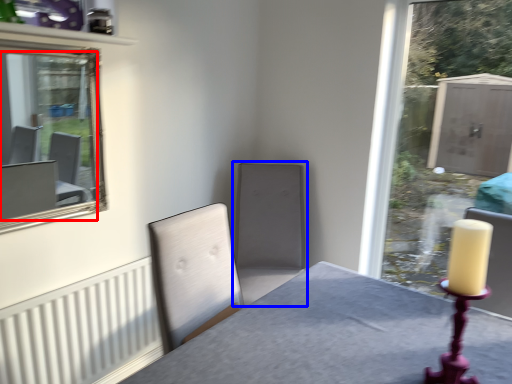
Question: Among these objects, which one is farthest to the camera, mirror (highlighted by a red box) or swivel chair (highlighted by a blue box)?

Choices:
 (A) mirror
 (B) swivel chair

Answer: (B)